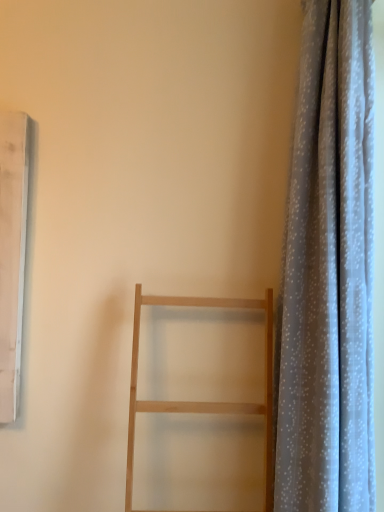
Question: Is light gray sheer curtain at right further to camera compared to natural wood ladder at center?

Choices:
 (A) no
 (B) yes

Answer: (B)

Question: Does light gray sheer curtain at right have a lesser width compared to natural wood ladder at center?

Choices:
 (A) yes
 (B) no

Answer: (A)

Question: From a real-world perspective, is light gray sheer curtain at right physically below natural wood ladder at center?

Choices:
 (A) yes
 (B) no

Answer: (B)

Question: From a real-world perspective, is light gray sheer curtain at right positioned over natural wood ladder at center based on gravity?

Choices:
 (A) yes
 (B) no

Answer: (A)

Question: Considering the relative sizes of light gray sheer curtain at right and natural wood ladder at center in the image provided, is light gray sheer curtain at right taller than natural wood ladder at center?

Choices:
 (A) yes
 (B) no

Answer: (A)

Question: Can you confirm if light gray sheer curtain at right is positioned to the left of natural wood ladder at center?

Choices:
 (A) no
 (B) yes

Answer: (A)

Question: Does natural wood ladder at center appear on the left side of light gray sheer curtain at right?

Choices:
 (A) no
 (B) yes

Answer: (B)

Question: Are natural wood ladder at center and light gray sheer curtain at right far apart?

Choices:
 (A) no
 (B) yes

Answer: (A)

Question: Is natural wood ladder at center closer to the viewer compared to light gray sheer curtain at right?

Choices:
 (A) no
 (B) yes

Answer: (B)

Question: From the image's perspective, is natural wood ladder at center on light gray sheer curtain at right?

Choices:
 (A) yes
 (B) no

Answer: (B)

Question: Is natural wood ladder at center further to camera compared to light gray sheer curtain at right?

Choices:
 (A) yes
 (B) no

Answer: (B)

Question: From a real-world perspective, is natural wood ladder at center positioned under light gray sheer curtain at right based on gravity?

Choices:
 (A) no
 (B) yes

Answer: (B)

Question: From a real-world perspective, is natural wood ladder at center above or below light gray sheer curtain at right?

Choices:
 (A) below
 (B) above

Answer: (A)